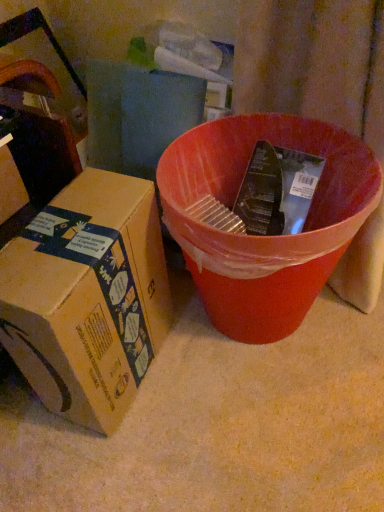
This screenshot has height=512, width=384. Find the location of `matte plastic bucket at center`. matte plastic bucket at center is located at coordinates (264, 237).

The width and height of the screenshot is (384, 512). I want to click on brown cardboard box at left, positioned as the first box in left-to-right order, so click(x=10, y=183).

What's the angular difference between brown cardboard box at left, positioned as the first box in left-to-right order, and matte plastic bucket at center's facing directions?

There is a 92.8-degree angle between the facing directions of brown cardboard box at left, positioned as the first box in left-to-right order, and matte plastic bucket at center.

In terms of size, does brown cardboard box at left, arranged as the 2th box when viewed from the right, appear bigger or smaller than matte plastic bucket at center?

Clearly, brown cardboard box at left, arranged as the 2th box when viewed from the right, is smaller in size than matte plastic bucket at center.

Which of these two, brown cardboard box at left, arranged as the 2th box when viewed from the right, or matte plastic bucket at center, is thinner?

brown cardboard box at left, arranged as the 2th box when viewed from the right.

Is brown cardboard box at left, positioned as the first box in left-to-right order, placed right next to matte plastic bucket at center?

No, brown cardboard box at left, positioned as the first box in left-to-right order, is not touching matte plastic bucket at center.

How distant is brown cardboard box at left, arranged as the 2th box when viewed from the right, from brown cardboard box at left, which is the 1th box from right to left?

The distance of brown cardboard box at left, arranged as the 2th box when viewed from the right, from brown cardboard box at left, which is the 1th box from right to left, is 8.18 inches.

Considering the sizes of brown cardboard box at left, positioned as the first box in left-to-right order, and brown cardboard box at left, arranged as the 2th box when viewed from the left, in the image, is brown cardboard box at left, positioned as the first box in left-to-right order, taller or shorter than brown cardboard box at left, arranged as the 2th box when viewed from the left,?

In the image, brown cardboard box at left, positioned as the first box in left-to-right order, appears to be shorter than brown cardboard box at left, arranged as the 2th box when viewed from the left.

From a real-world perspective, is brown cardboard box at left, positioned as the first box in left-to-right order, physically below brown cardboard box at left, which is the 1th box from right to left?

No, from a real-world perspective, brown cardboard box at left, positioned as the first box in left-to-right order, is not beneath brown cardboard box at left, which is the 1th box from right to left.

Can you confirm if brown cardboard box at left, positioned as the first box in left-to-right order, is bigger than brown cardboard box at left, arranged as the 2th box when viewed from the left?

No, brown cardboard box at left, positioned as the first box in left-to-right order, is not bigger than brown cardboard box at left, arranged as the 2th box when viewed from the left.

Which of these two, matte plastic bucket at center or brown cardboard box at left, arranged as the 2th box when viewed from the right, is smaller?

brown cardboard box at left, arranged as the 2th box when viewed from the right.

In the image, is matte plastic bucket at center on the left side or the right side of brown cardboard box at left, arranged as the 2th box when viewed from the right?

In the image, matte plastic bucket at center appears on the right side of brown cardboard box at left, arranged as the 2th box when viewed from the right.

Does matte plastic bucket at center touch brown cardboard box at left, positioned as the first box in left-to-right order?

No, matte plastic bucket at center is not beside brown cardboard box at left, positioned as the first box in left-to-right order.

Does matte plastic bucket at center lie behind brown cardboard box at left, positioned as the first box in left-to-right order?

Yes, matte plastic bucket at center is behind brown cardboard box at left, positioned as the first box in left-to-right order.

From the image's perspective, which is below, brown cardboard box at left, arranged as the 2th box when viewed from the left, or brown cardboard box at left, positioned as the first box in left-to-right order?

brown cardboard box at left, arranged as the 2th box when viewed from the left.

In the image, is brown cardboard box at left, arranged as the 2th box when viewed from the left, on the left side or the right side of brown cardboard box at left, positioned as the first box in left-to-right order?

brown cardboard box at left, arranged as the 2th box when viewed from the left, is to the right of brown cardboard box at left, positioned as the first box in left-to-right order.

Consider the image. Considering the relative sizes of brown cardboard box at left, arranged as the 2th box when viewed from the left, and brown cardboard box at left, positioned as the first box in left-to-right order, in the image provided, is brown cardboard box at left, arranged as the 2th box when viewed from the left, smaller than brown cardboard box at left, positioned as the first box in left-to-right order,?

No, brown cardboard box at left, arranged as the 2th box when viewed from the left, is not smaller than brown cardboard box at left, positioned as the first box in left-to-right order.

Are brown cardboard box at left, arranged as the 2th box when viewed from the left, and brown cardboard box at left, positioned as the first box in left-to-right order, far apart?

No.

Would you consider brown cardboard box at left, arranged as the 2th box when viewed from the left, to be distant from matte plastic bucket at center?

No, brown cardboard box at left, arranged as the 2th box when viewed from the left, is not far from matte plastic bucket at center.

From the image's perspective, is brown cardboard box at left, arranged as the 2th box when viewed from the left, over matte plastic bucket at center?

No.

Which point is more forward, (123, 385) or (374, 207)?

The point (374, 207) is in front.

Does matte plastic bucket at center lie in front of brown cardboard box at left, which is the 1th box from right to left?

That is False.

Which object is positioned more to the left, matte plastic bucket at center or brown cardboard box at left, which is the 1th box from right to left?

brown cardboard box at left, which is the 1th box from right to left, is more to the left.

From the image's perspective, which one is positioned lower, matte plastic bucket at center or brown cardboard box at left, arranged as the 2th box when viewed from the left?

brown cardboard box at left, arranged as the 2th box when viewed from the left.

Which of these two, matte plastic bucket at center or brown cardboard box at left, which is the 1th box from right to left, is bigger?

With larger size is matte plastic bucket at center.

This screenshot has width=384, height=512. Identify the location of bucket behind the brown cardboard box at left, arranged as the 2th box when viewed from the right. (264, 237).

You are a GUI agent. You are given a task and a screenshot of the screen. Output one action in this format:
    pyautogui.click(x=<x>, y=<y>)
    Task: Click on the box above the brown cardboard box at left, which is the 1th box from right to left (from a real-world perspective)
    Image resolution: width=384 pixels, height=512 pixels.
    Given the screenshot: What is the action you would take?
    pyautogui.click(x=10, y=183)

Based on their spatial positions, is brown cardboard box at left, arranged as the 2th box when viewed from the right, or brown cardboard box at left, which is the 1th box from right to left, closer to matte plastic bucket at center?

brown cardboard box at left, which is the 1th box from right to left, is closer to matte plastic bucket at center.

Estimate the real-world distances between objects in this image. Which object is further from brown cardboard box at left, which is the 1th box from right to left, matte plastic bucket at center or brown cardboard box at left, positioned as the first box in left-to-right order?

Based on the image, brown cardboard box at left, positioned as the first box in left-to-right order, appears to be further to brown cardboard box at left, which is the 1th box from right to left.

Based on their spatial positions, is brown cardboard box at left, arranged as the 2th box when viewed from the left, or brown cardboard box at left, positioned as the first box in left-to-right order, closer to matte plastic bucket at center?

brown cardboard box at left, arranged as the 2th box when viewed from the left, is positioned closer to the anchor matte plastic bucket at center.

Which object lies nearer to the anchor point brown cardboard box at left, arranged as the 2th box when viewed from the right, brown cardboard box at left, arranged as the 2th box when viewed from the left, or matte plastic bucket at center?

The object closer to brown cardboard box at left, arranged as the 2th box when viewed from the right, is brown cardboard box at left, arranged as the 2th box when viewed from the left.

Looking at the image, which one is located closer to brown cardboard box at left, arranged as the 2th box when viewed from the left, brown cardboard box at left, positioned as the first box in left-to-right order, or matte plastic bucket at center?

matte plastic bucket at center is positioned closer to the anchor brown cardboard box at left, arranged as the 2th box when viewed from the left.

When comparing their distances from brown cardboard box at left, positioned as the first box in left-to-right order, does matte plastic bucket at center or brown cardboard box at left, arranged as the 2th box when viewed from the left, seem closer?

brown cardboard box at left, arranged as the 2th box when viewed from the left.

You are a GUI agent. You are given a task and a screenshot of the screen. Output one action in this format:
    pyautogui.click(x=<x>, y=<y>)
    Task: Click on the box between brown cardboard box at left, arranged as the 2th box when viewed from the right, and matte plastic bucket at center from left to right
    This screenshot has width=384, height=512.
    Given the screenshot: What is the action you would take?
    pyautogui.click(x=87, y=297)